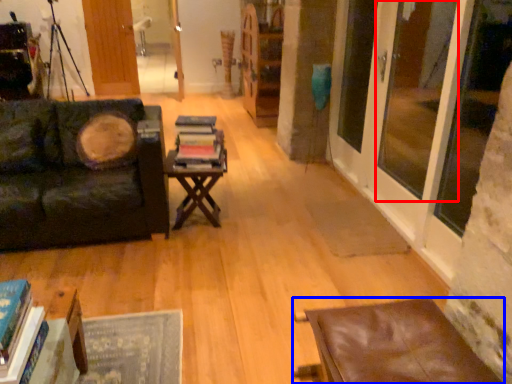
Question: Which of the following is the closest to the observer, window screen (highlighted by a red box) or table (highlighted by a blue box)?

Choices:
 (A) window screen
 (B) table

Answer: (B)